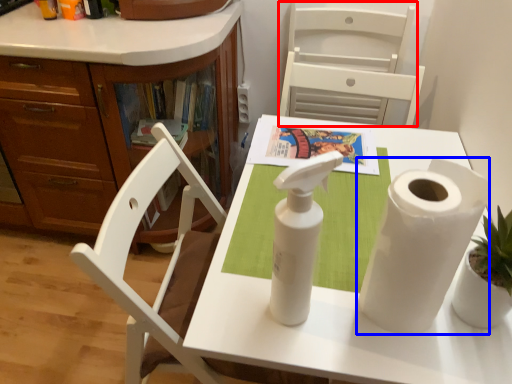
Question: Which object appears closest to the camera in this image, armchair (highlighted by a red box) or paper towel (highlighted by a blue box)?

Choices:
 (A) armchair
 (B) paper towel

Answer: (B)